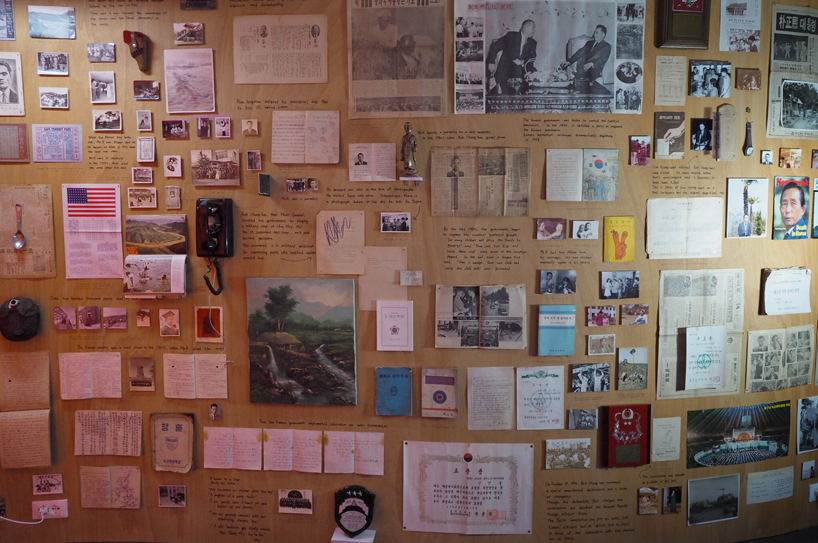
The width and height of the screenshot is (818, 543). Identify the location of statue. (402, 141).